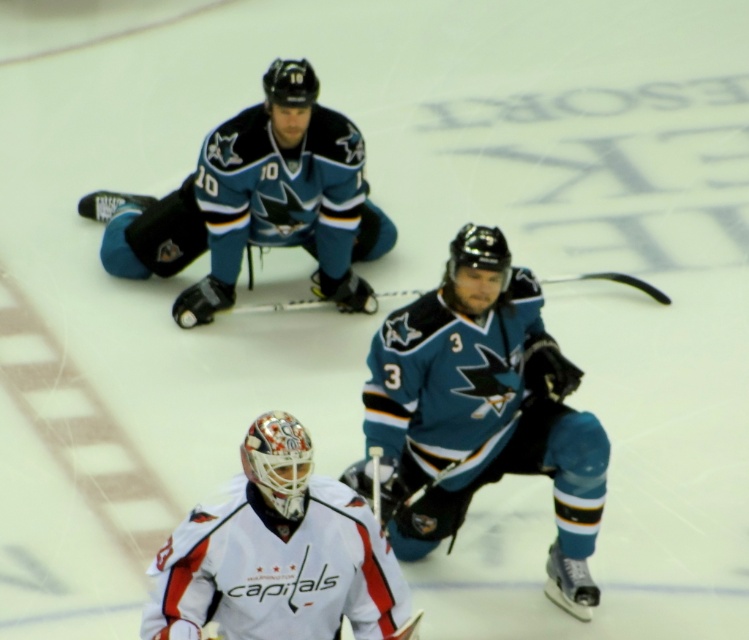
Which is in front, point (560, 420) or point (562, 282)?

Point (560, 420)

Does point (583, 548) come in front of point (246, 310)?

Yes.

Locate an element on the screen. The height and width of the screenshot is (640, 749). teal jersey at center is located at coordinates (482, 410).

Who is positioned more to the left, white matte goalie mask at center or black matte hockey stick at center?

white matte goalie mask at center is more to the left.

Is white matte goalie mask at center shorter than black matte hockey stick at center?

No.

Does point (333, 508) come in front of point (664, 292)?

Yes, point (333, 508) is closer to viewer.

In order to click on white matte goalie mask at center in this screenshot , I will do `click(278, 554)`.

Does teal jersey at center have a lesser height compared to white matte goalie mask at center?

In fact, teal jersey at center may be taller than white matte goalie mask at center.

Does teal jersey at center appear under white matte goalie mask at center?

Incorrect, teal jersey at center is not positioned below white matte goalie mask at center.

Locate an element on the screen. This screenshot has width=749, height=640. teal jersey at center is located at coordinates (482, 410).